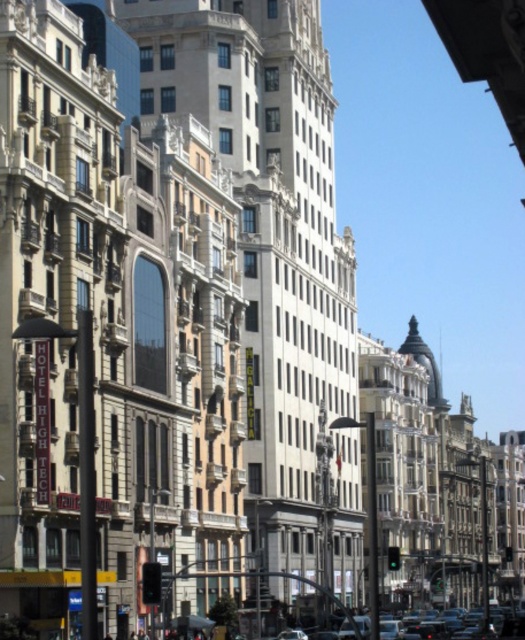
Question: Is smooth gray building at center wider than green glass traffic light at center?

Choices:
 (A) no
 (B) yes

Answer: (B)

Question: Can you confirm if smooth gray building at center is positioned to the left of green glass traffic light at center?

Choices:
 (A) yes
 (B) no

Answer: (A)

Question: Which object is the closest to the green glass traffic light at center?

Choices:
 (A) black plastic traffic light at lower center
 (B) smooth gray building at center

Answer: (A)

Question: Based on their relative distances, which object is farther from the green glass traffic light at center?

Choices:
 (A) black plastic traffic light at lower center
 (B) smooth gray building at center

Answer: (B)

Question: Which of the following is the closest to the observer?

Choices:
 (A) (391, 557)
 (B) (254, 275)

Answer: (A)

Question: Can you confirm if black plastic traffic light at lower center is thinner than green glass traffic light at center?

Choices:
 (A) no
 (B) yes

Answer: (B)